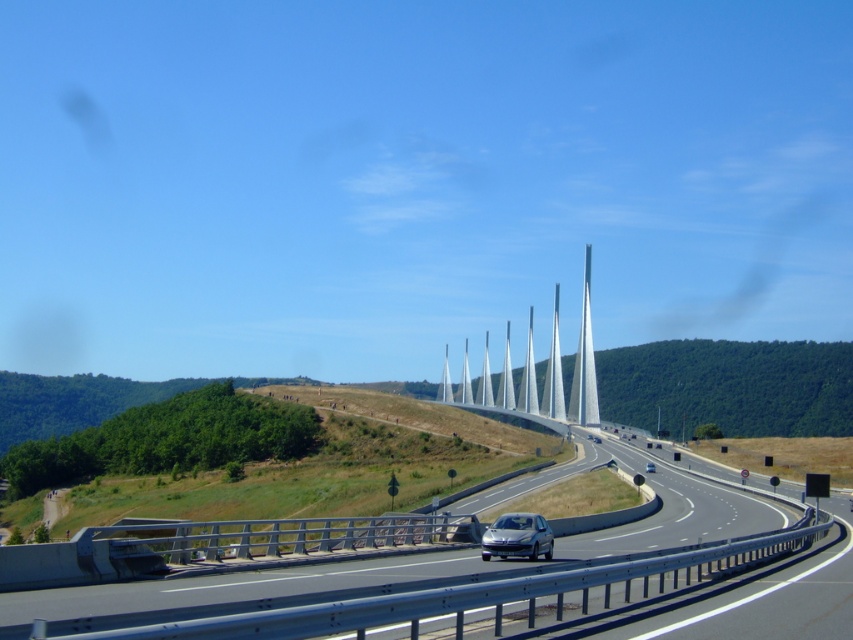
Question: Does gray asphalt highway at center appear on the right side of silver metallic car at center?

Choices:
 (A) yes
 (B) no

Answer: (B)

Question: Among these points, which one is nearest to the camera?

Choices:
 (A) (654, 472)
 (B) (166, 616)
 (C) (520, 522)

Answer: (B)

Question: Which object is farther from the camera taking this photo?

Choices:
 (A) gray asphalt highway at center
 (B) silver metallic car at center

Answer: (B)

Question: Which point appears farthest from the camera in this image?

Choices:
 (A) [x=505, y=545]
 (B) [x=264, y=577]

Answer: (A)

Question: Is gray asphalt highway at center in front of silver metallic car at center?

Choices:
 (A) no
 (B) yes

Answer: (B)

Question: Is gray asphalt highway at center further to the viewer compared to satin silver car at center?

Choices:
 (A) yes
 (B) no

Answer: (B)